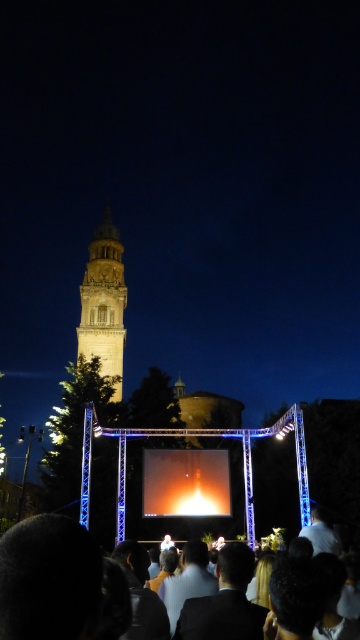
Does light beige stone bell tower at center have a larger size compared to shiny orange rocket at center?

Yes.

Can you confirm if light beige stone bell tower at center is positioned to the left of shiny orange rocket at center?

Correct, you'll find light beige stone bell tower at center to the left of shiny orange rocket at center.

Is point (123, 292) positioned behind point (155, 484)?

Yes, point (123, 292) is behind point (155, 484).

Where is `light beige stone bell tower at center`? This screenshot has width=360, height=640. light beige stone bell tower at center is located at coordinates (104, 301).

This screenshot has width=360, height=640. I want to click on dark suit crowd at lower center, so click(x=48, y=580).

Which is in front, point (2, 570) or point (96, 253)?

Point (2, 570) is more forward.

You are a GUI agent. You are given a task and a screenshot of the screen. Output one action in this format:
    pyautogui.click(x=<x>, y=<y>)
    Task: Click on the dark suit crowd at lower center
    
    Given the screenshot: What is the action you would take?
    pyautogui.click(x=48, y=580)

The width and height of the screenshot is (360, 640). Describe the element at coordinates (48, 580) in the screenshot. I see `dark suit crowd at lower center` at that location.

Is dark suit crowd at lower center positioned in front of shiny orange rocket at center?

That is True.

What are the coordinates of `dark suit crowd at lower center` in the screenshot? It's located at (48, 580).

In order to click on dark suit crowd at lower center in this screenshot , I will do `click(48, 580)`.